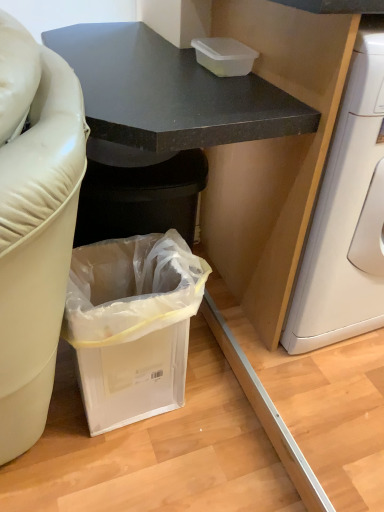
Question: Is transparent plastic container at upper center situated inside matte black cabinet at lower left or outside?

Choices:
 (A) outside
 (B) inside

Answer: (A)

Question: In the image, is transparent plastic container at upper center positioned in front of or behind matte black cabinet at lower left?

Choices:
 (A) front
 (B) behind

Answer: (B)

Question: Considering the real-world distances, which object is farthest from the matte black cabinet at lower left?

Choices:
 (A) clear plastic trash can at lower left
 (B) transparent plastic container at upper center

Answer: (A)

Question: Based on their relative distances, which object is nearer to the matte black cabinet at lower left?

Choices:
 (A) transparent plastic container at upper center
 (B) clear plastic trash can at lower left

Answer: (A)